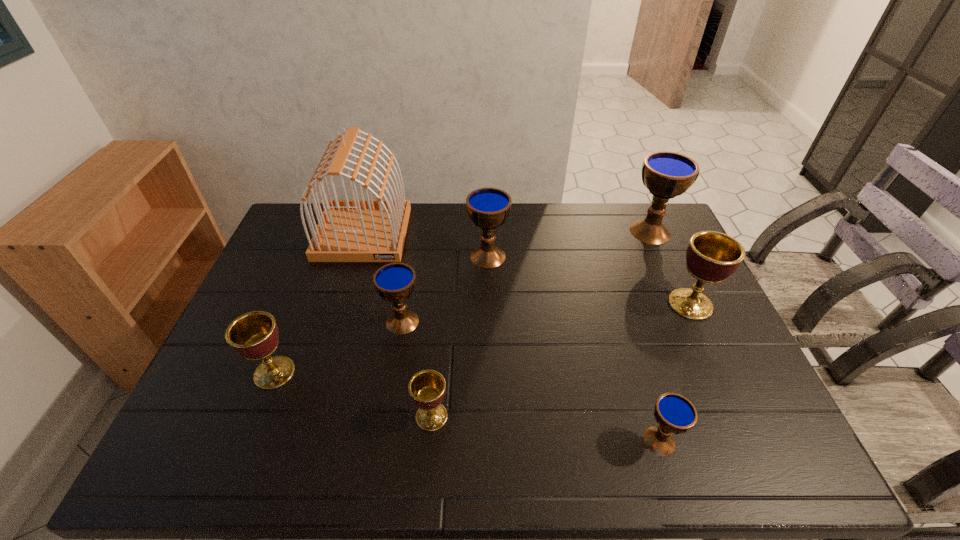
The width and height of the screenshot is (960, 540). I want to click on birdcage, so pyautogui.click(x=356, y=230).

You are a GUI agent. You are given a task and a screenshot of the screen. Output one action in this format:
    pyautogui.click(x=<x>, y=<y>)
    Task: Click on the beige birdcage
    
    Given the screenshot: What is the action you would take?
    pyautogui.click(x=356, y=230)

At what (x,y) coordinates should I click in order to perform the action: click on the second tallest object. Please return your answer as a coordinate pair (x, y). Looking at the image, I should click on (666, 175).

Image resolution: width=960 pixels, height=540 pixels. What are the coordinates of `the biggest blue chalice` in the screenshot? It's located at (x=666, y=175).

What are the coordinates of `the second biggest blue chalice` in the screenshot? It's located at (488, 208).

This screenshot has height=540, width=960. Find the location of `the second blue chalice from left to right`. the second blue chalice from left to right is located at coordinates [x=488, y=208].

Where is `the farthest golden chalice`? the farthest golden chalice is located at coordinates (711, 257).

Locate an element on the screen. The image size is (960, 540). the biggest golden chalice is located at coordinates (711, 257).

At what (x,y) coordinates should I click in order to perform the action: click on the sixth chalice from right to left. Please return your answer as a coordinate pair (x, y). The width and height of the screenshot is (960, 540). Looking at the image, I should click on (395, 282).

Where is `the second smallest blue chalice`? Image resolution: width=960 pixels, height=540 pixels. the second smallest blue chalice is located at coordinates (395, 282).